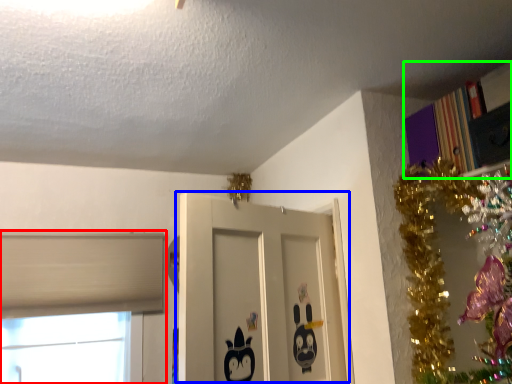
Question: Which object is positioned closest to window (highlighted by a red box)? Select from door (highlighted by a blue box) and bookcase (highlighted by a green box).

Choices:
 (A) door
 (B) bookcase

Answer: (A)